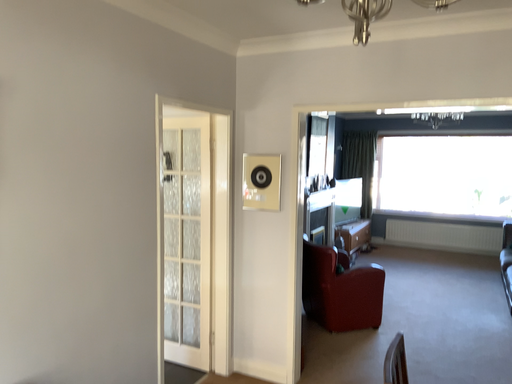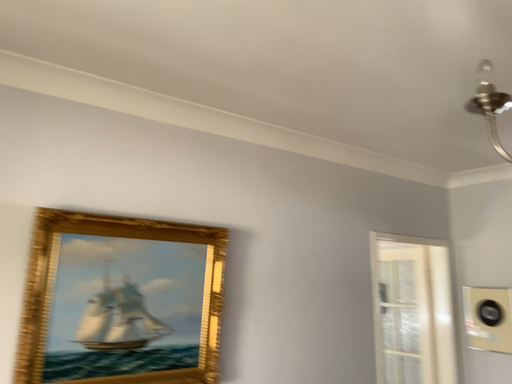
Question: How did the camera likely rotate when shooting the video?

Choices:
 (A) rotated right
 (B) rotated left

Answer: (B)